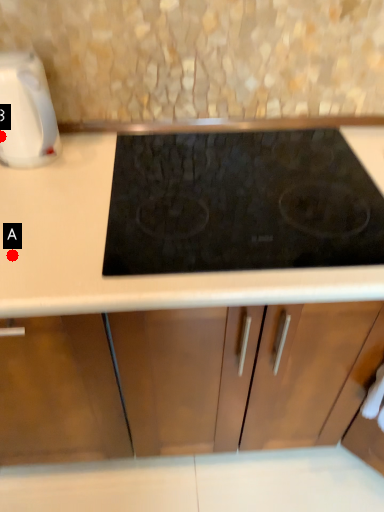
Question: Two points are circled on the image, labeled by A and B beside each circle. Which of the following is the closest to the observer?

Choices:
 (A) A is closer
 (B) B is closer

Answer: (A)